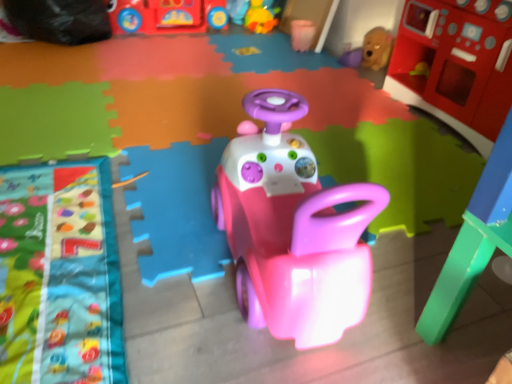
Question: Is point (291, 39) closer or farther from the camera than point (301, 266)?

Choices:
 (A) farther
 (B) closer

Answer: (A)

Question: Is pink plastic cup at upper center, acting as the 4th toy starting from the left, in front of or behind pink plastic car at center, the fourth toy viewed from the right, in the image?

Choices:
 (A) front
 (B) behind

Answer: (B)

Question: Estimate the real-world distances between objects in this image. Which object is closer to the pink plastic car at center, the fourth toy viewed from the right?

Choices:
 (A) matte brown teddy bear at upper right, acting as the 2th toy starting from the right
 (B) rubber duck at upper center, which appears as the second toy when viewed from the left
 (C) pink plastic cup at upper center, which ranks as the 3th toy in right-to-left order
 (D) rubberized red play kitchen at upper right, marked as the 1th toy in a right-to-left arrangement
 (E) shiny plastic bus at upper center, marked as the 1th toy in a left-to-right arrangement

Answer: (D)

Question: Which is nearer to the rubberized red play kitchen at upper right, marked as the 1th toy in a right-to-left arrangement?

Choices:
 (A) pink plastic cup at upper center, which ranks as the 3th toy in right-to-left order
 (B) shiny plastic bus at upper center, marked as the 1th toy in a left-to-right arrangement
 (C) pink plastic car at center, the fourth toy viewed from the right
 (D) rubber duck at upper center, which appears as the second toy when viewed from the left
 (E) matte brown teddy bear at upper right, which is counted as the fifth toy, starting from the left

Answer: (E)